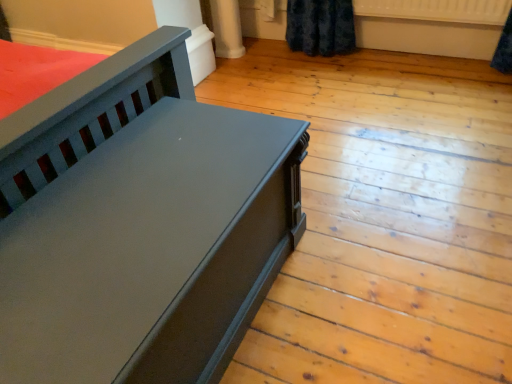
Question: Could you tell me if white plastic radiator at upper right is facing matte black bench at left?

Choices:
 (A) no
 (B) yes

Answer: (B)

Question: From a real-world perspective, is white plastic radiator at upper right below matte black bench at left?

Choices:
 (A) no
 (B) yes

Answer: (A)

Question: Is white plastic radiator at upper right beside matte black bench at left?

Choices:
 (A) yes
 (B) no

Answer: (B)

Question: Can you confirm if white plastic radiator at upper right is shorter than matte black bench at left?

Choices:
 (A) yes
 (B) no

Answer: (A)

Question: From the image's perspective, would you say white plastic radiator at upper right is shown under matte black bench at left?

Choices:
 (A) yes
 (B) no

Answer: (B)

Question: Is white plastic radiator at upper right bigger than matte black bench at left?

Choices:
 (A) no
 (B) yes

Answer: (A)

Question: Is matte black bench at left facing towards white plastic radiator at upper right?

Choices:
 (A) no
 (B) yes

Answer: (A)

Question: Is matte black bench at left wider than white plastic radiator at upper right?

Choices:
 (A) yes
 (B) no

Answer: (A)

Question: From a real-world perspective, is matte black bench at left below white plastic radiator at upper right?

Choices:
 (A) no
 (B) yes

Answer: (B)

Question: Are matte black bench at left and white plastic radiator at upper right making contact?

Choices:
 (A) yes
 (B) no

Answer: (B)

Question: Is matte black bench at left positioned with its back to white plastic radiator at upper right?

Choices:
 (A) yes
 (B) no

Answer: (B)

Question: Does matte black bench at left come in front of white plastic radiator at upper right?

Choices:
 (A) yes
 (B) no

Answer: (A)

Question: Based on their positions, is white plastic radiator at upper right located to the left or right of matte black bench at left?

Choices:
 (A) left
 (B) right

Answer: (B)